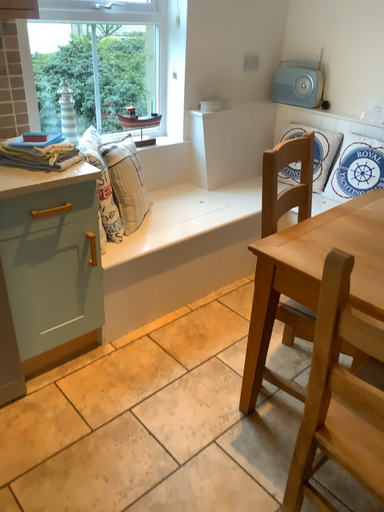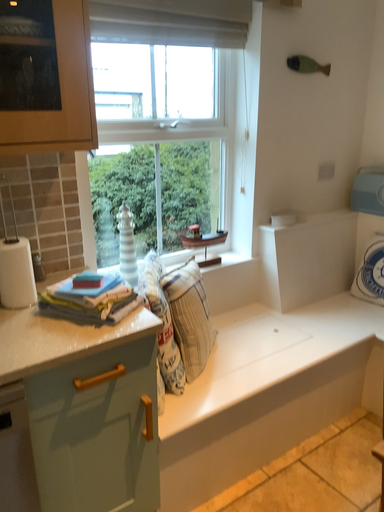
Question: How did the camera likely rotate when shooting the video?

Choices:
 (A) rotated upward
 (B) rotated downward

Answer: (A)